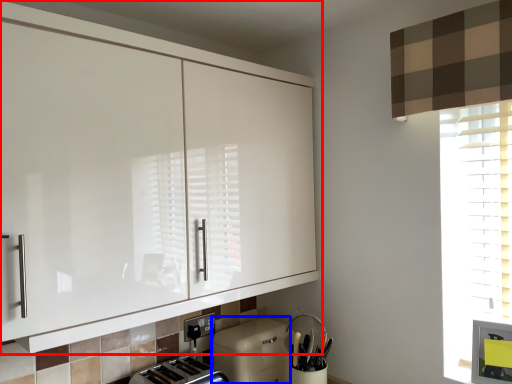
Question: Which object is closer to the camera taking this photo, cabinetry (highlighted by a red box) or dish washer (highlighted by a blue box)?

Choices:
 (A) cabinetry
 (B) dish washer

Answer: (A)